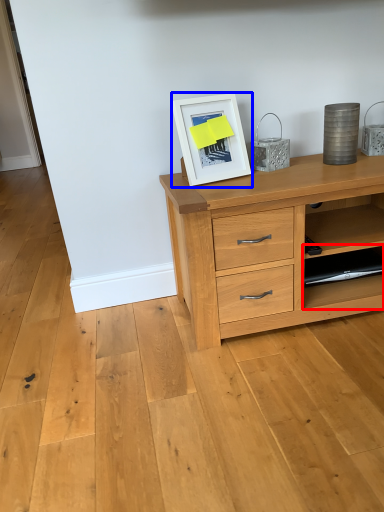
Question: Which point is closer to the camera, shelf (highlighted by a red box) or picture frame (highlighted by a blue box)?

Choices:
 (A) shelf
 (B) picture frame

Answer: (B)